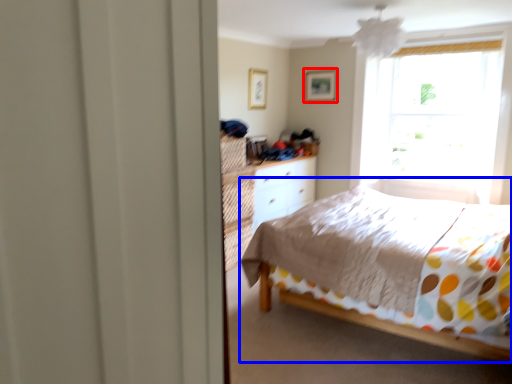
Question: Which of the following is the farthest to the observer, picture frame (highlighted by a red box) or bed (highlighted by a blue box)?

Choices:
 (A) picture frame
 (B) bed

Answer: (A)